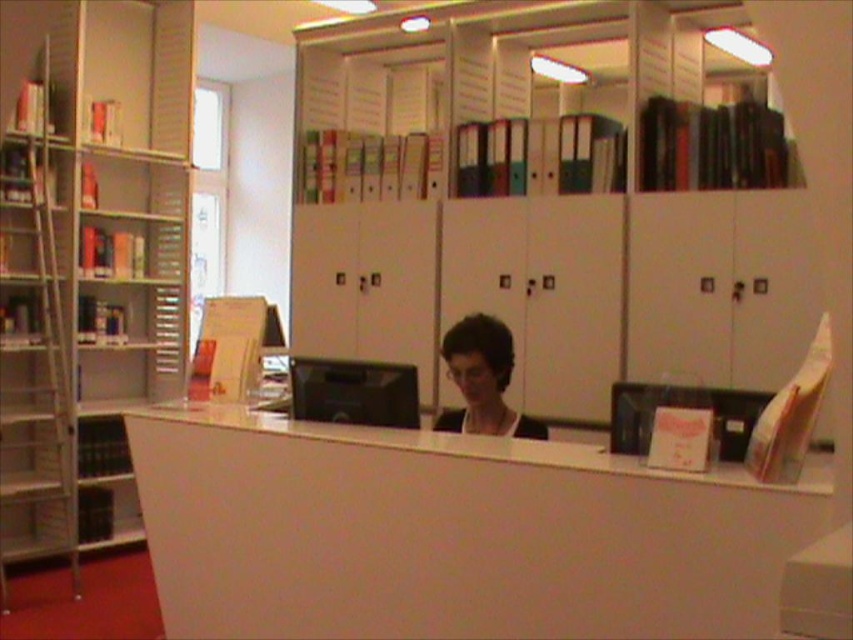
Question: Is white matte desk at center thinner than metallic silver bookshelf at left?

Choices:
 (A) yes
 (B) no

Answer: (B)

Question: Estimate the real-world distances between objects in this image. Which object is farther from the metallic silver bookshelf at left?

Choices:
 (A) white matte desk at center
 (B) matte black hair at center

Answer: (B)

Question: Can you confirm if metallic silver bookshelf at left is positioned above matte black hair at center?

Choices:
 (A) yes
 (B) no

Answer: (A)

Question: Among these objects, which one is farthest from the camera?

Choices:
 (A) matte black hair at center
 (B) metallic silver bookshelf at left
 (C) white matte desk at center

Answer: (B)

Question: Is metallic silver bookshelf at left to the left of matte black hair at center from the viewer's perspective?

Choices:
 (A) yes
 (B) no

Answer: (A)

Question: Among these objects, which one is nearest to the camera?

Choices:
 (A) metallic silver bookshelf at left
 (B) white matte desk at center

Answer: (B)